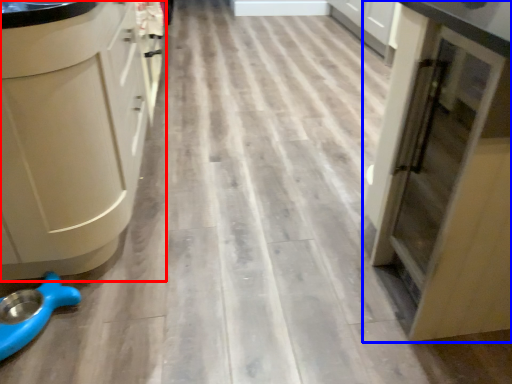
Question: Among these objects, which one is farthest to the camera, cabinetry (highlighted by a red box) or cupboard (highlighted by a blue box)?

Choices:
 (A) cabinetry
 (B) cupboard

Answer: (A)